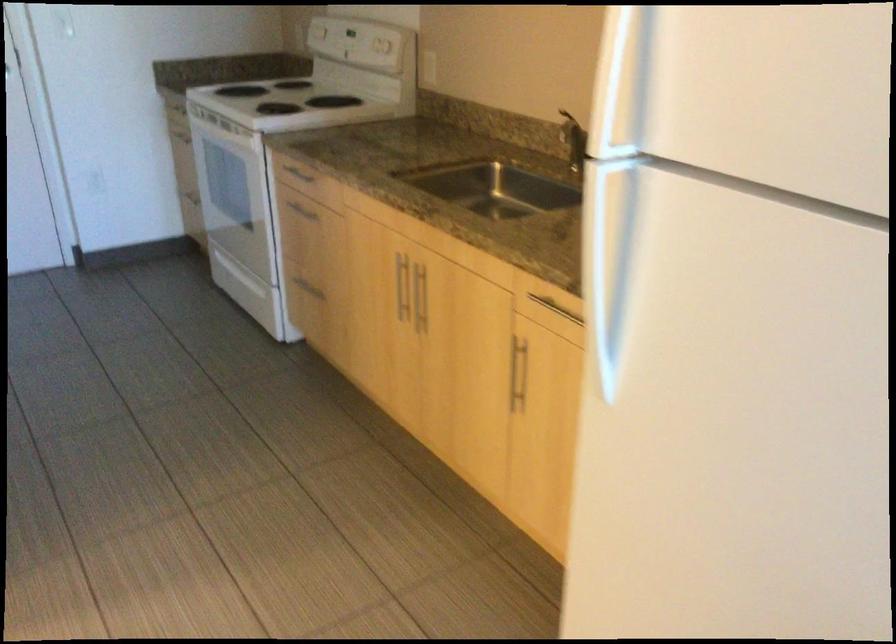
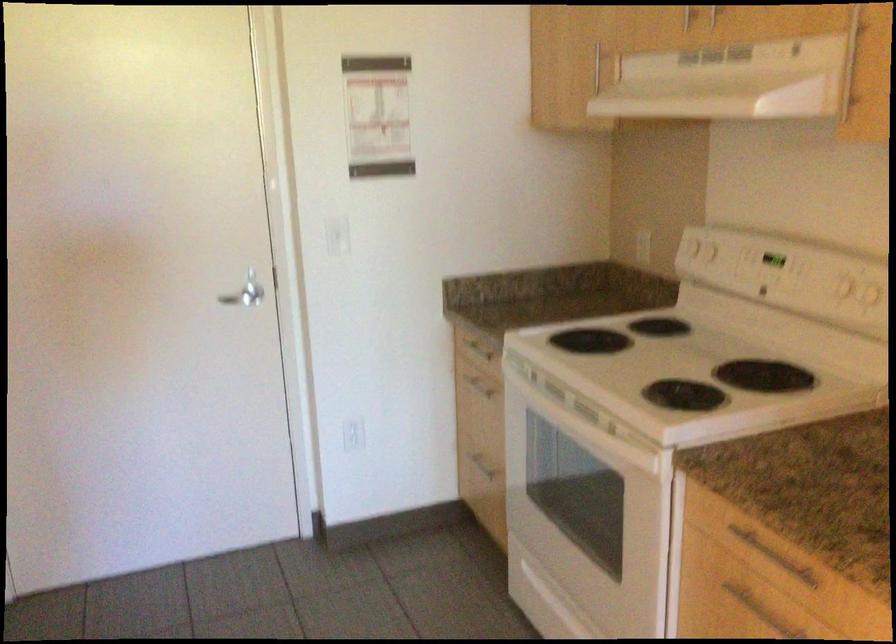
Find the pixel in the second image that matches point (185, 116) in the first image.

(476, 346)